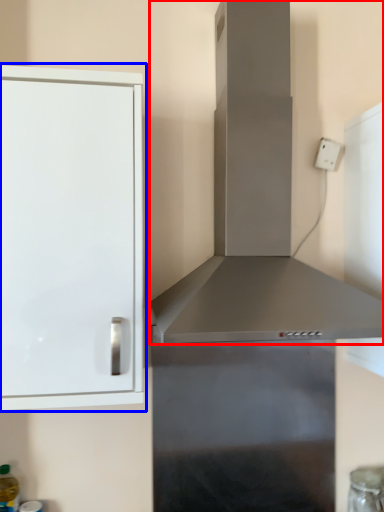
Question: Among these objects, which one is farthest to the camera, vent (highlighted by a red box) or cabinetry (highlighted by a blue box)?

Choices:
 (A) vent
 (B) cabinetry

Answer: (B)